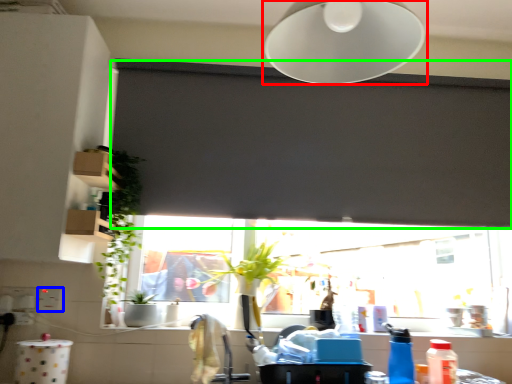
Question: Estimate the real-world distances between objects in this image. Which object is closer to lamp (highlighted by a red box), electric outlet (highlighted by a blue box) or window screen (highlighted by a green box)?

Choices:
 (A) electric outlet
 (B) window screen

Answer: (B)